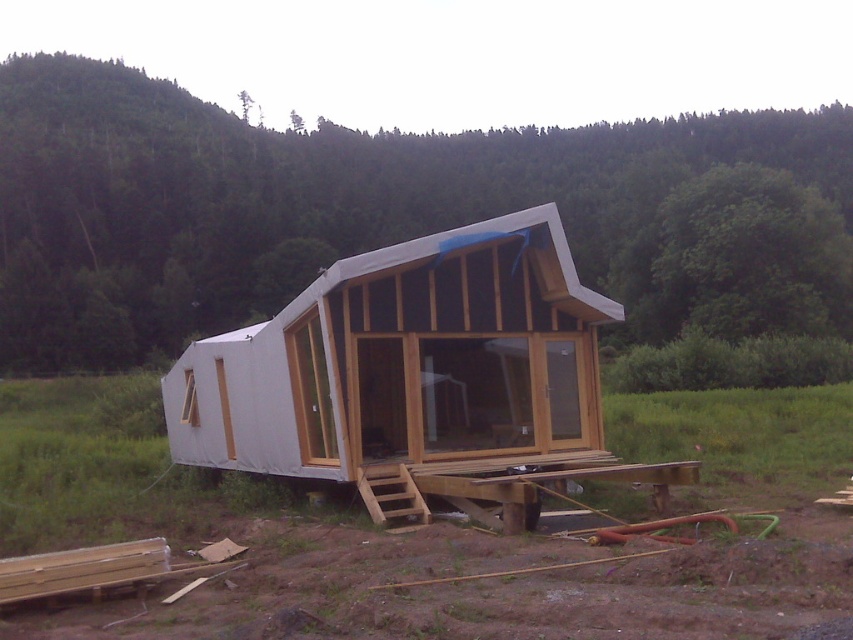
You are planning to install a new solar panel system between the white wood cabin at center and the white matte cabin at center. The solar panels require a minimum of 80 meters of space between the two structures for proper installation. Based on the current distance, is this feasible?

The white wood cabin at center and white matte cabin at center are 78.22 meters apart from each other. Since the required minimum distance is 80 meters, the solar panel installation is not feasible as the current distance is insufficient.